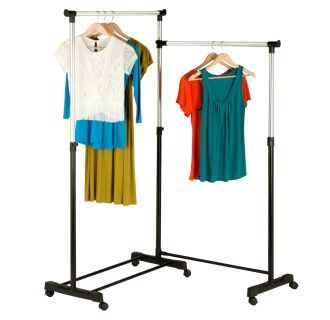
Locate an element on the screen. The height and width of the screenshot is (320, 330). hangers is located at coordinates (93, 23), (107, 23), (115, 27), (210, 52), (217, 56).